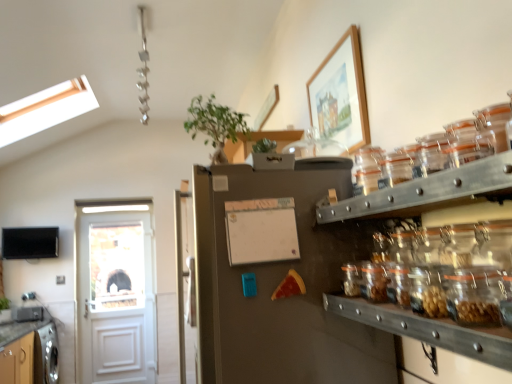
Question: Should I look upward or downward to see green leafy plant at upper center?

Choices:
 (A) up
 (B) down

Answer: (A)

Question: Does white wooden door at left have a smaller size compared to white matte bulletin board at center?

Choices:
 (A) yes
 (B) no

Answer: (B)

Question: Is white wooden door at left closer to camera compared to white matte bulletin board at center?

Choices:
 (A) no
 (B) yes

Answer: (A)

Question: Is white wooden door at left next to white matte bulletin board at center and touching it?

Choices:
 (A) yes
 (B) no

Answer: (B)

Question: Does white wooden door at left lie behind white matte bulletin board at center?

Choices:
 (A) yes
 (B) no

Answer: (A)

Question: From a real-world perspective, is white wooden door at left located higher than white matte bulletin board at center?

Choices:
 (A) yes
 (B) no

Answer: (B)

Question: Does white wooden door at left have a lesser height compared to white matte bulletin board at center?

Choices:
 (A) yes
 (B) no

Answer: (B)

Question: From the image's perspective, is green leafy plant at upper center beneath white matte bulletin board at center?

Choices:
 (A) yes
 (B) no

Answer: (B)

Question: Does green leafy plant at upper center have a greater height compared to white matte bulletin board at center?

Choices:
 (A) yes
 (B) no

Answer: (A)

Question: Is green leafy plant at upper center positioned before white matte bulletin board at center?

Choices:
 (A) yes
 (B) no

Answer: (B)

Question: Is green leafy plant at upper center located outside white matte bulletin board at center?

Choices:
 (A) no
 (B) yes

Answer: (B)

Question: From a real-world perspective, is green leafy plant at upper center physically above white matte bulletin board at center?

Choices:
 (A) yes
 (B) no

Answer: (A)

Question: Considering the relative positions of green leafy plant at upper center and white matte bulletin board at center in the image provided, is green leafy plant at upper center behind white matte bulletin board at center?

Choices:
 (A) no
 (B) yes

Answer: (B)

Question: From the image's perspective, does green leafy plant at upper center appear higher than clear glass jars at center right?

Choices:
 (A) yes
 (B) no

Answer: (A)